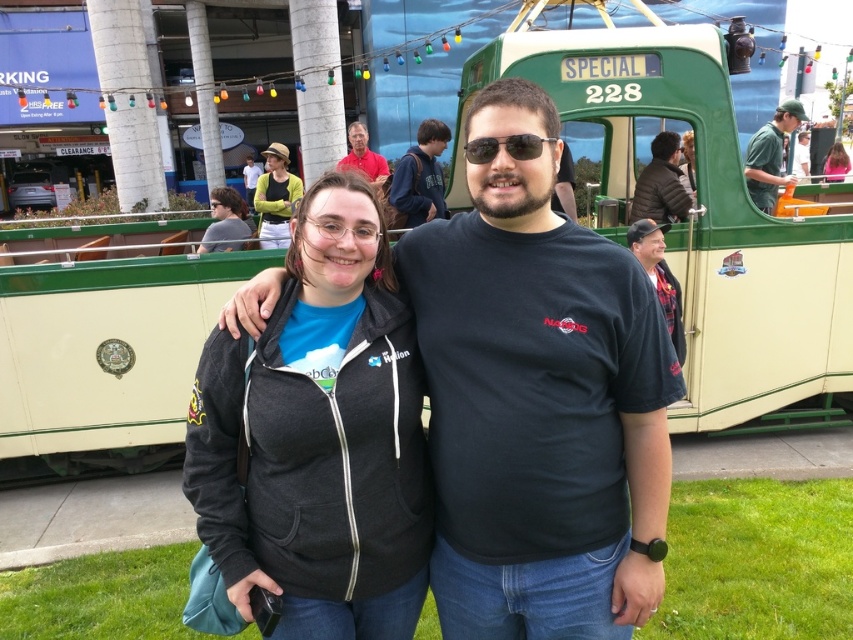
Find the location of a particular element. Image resolution: width=853 pixels, height=640 pixels. pink fabric at center is located at coordinates (834, 163).

Which is below, black matte t-shirt at center or matte black jacket at upper center?

black matte t-shirt at center

Identify the location of black matte t-shirt at center. (538, 401).

Who is more forward, (503, 216) or (682, 147)?

Positioned in front is point (503, 216).

Locate an element on the screen. Image resolution: width=853 pixels, height=640 pixels. black matte t-shirt at center is located at coordinates (538, 401).

Does blue fleece jacket at upper center come behind yellow fabric hat at upper center?

No, it is in front of yellow fabric hat at upper center.

Is blue fleece jacket at upper center smaller than yellow fabric hat at upper center?

Correct, blue fleece jacket at upper center occupies less space than yellow fabric hat at upper center.

Identify the location of blue fleece jacket at upper center. (421, 177).